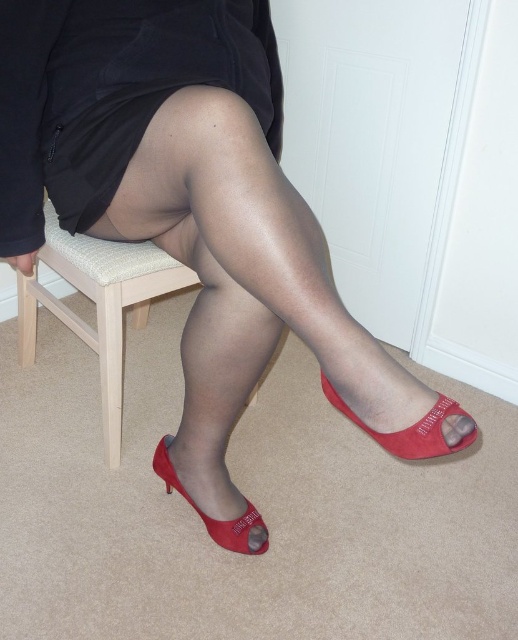
Question: Is matte red peep-toe shoe at lower center to the right of matte red shoe at lower right from the viewer's perspective?

Choices:
 (A) yes
 (B) no

Answer: (B)

Question: Is matte red high-heeled shoe at lower right thinner than matte red high-heeled shoe at lower center?

Choices:
 (A) yes
 (B) no

Answer: (B)

Question: Which point appears closest to the camera in this image?

Choices:
 (A) (11, 132)
 (B) (198, 512)
 (C) (168, 460)

Answer: (A)

Question: Does transparent nylon sock at lower center appear on the left side of matte red shoe at lower right?

Choices:
 (A) yes
 (B) no

Answer: (A)

Question: Considering the real-world distances, which object is closest to the light wood chair at center?

Choices:
 (A) matte red peep-toe shoe at lower center
 (B) satin black tights at center
 (C) black sheer dress at center

Answer: (B)

Question: Which point is closer to the camera taking this photo?

Choices:
 (A) (396, 452)
 (B) (225, 541)

Answer: (A)